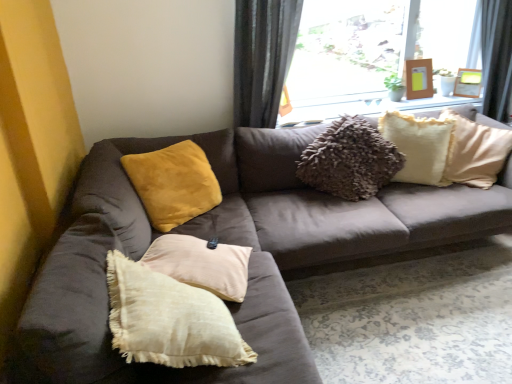
Question: Is velvet yellow pillow at upper left, the 1th pillow when ordered from left to right, inside or outside of wooden picture frame at upper right, which ranks as the 1th picture frame in left-to-right order?

Choices:
 (A) inside
 (B) outside

Answer: (B)

Question: From the image's perspective, is velvet yellow pillow at upper left, the 1th pillow when ordered from left to right, positioned above or below wooden picture frame at upper right, the second picture frame when ordered from right to left?

Choices:
 (A) below
 (B) above

Answer: (A)

Question: Which object is the closest to the velvet yellow pillow at upper left, the 1th pillow when ordered from left to right?

Choices:
 (A) gray fabric curtain at upper center
 (B) fuzzy cream pillow at upper right, which is the 2th pillow in left-to-right order
 (C) suede brown couch at center
 (D) wooden frame at upper center
 (E) wooden picture frame at upper right, which appears as the second picture frame when viewed from the left

Answer: (C)

Question: Based on their relative distances, which object is farther from the suede brown couch at center?

Choices:
 (A) fuzzy cream pillow at upper right, which is the 1th pillow from right to left
 (B) transparent glass window at upper center
 (C) wooden frame at upper center
 (D) gray fabric curtain at upper center
 (E) wooden picture frame at upper right, the second picture frame when ordered from right to left

Answer: (E)